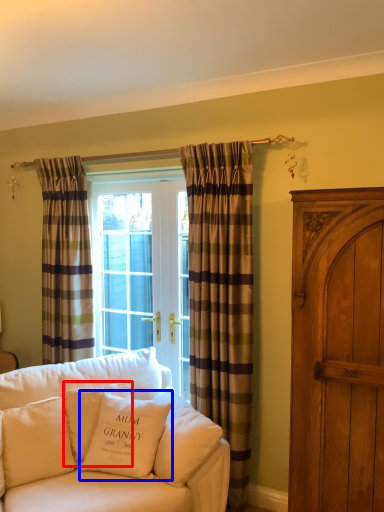
Question: Which object is closer to the camera taking this photo, pillow (highlighted by a red box) or pillow (highlighted by a blue box)?

Choices:
 (A) pillow
 (B) pillow

Answer: (B)